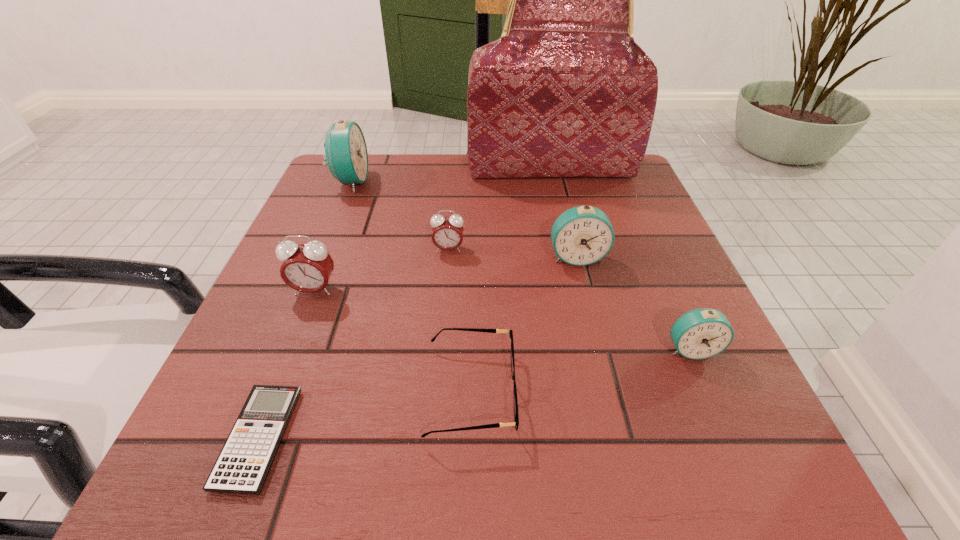
Image resolution: width=960 pixels, height=540 pixels. I want to click on blank region between the second nearest blue alarm clock and the rightmost blue alarm clock, so click(x=634, y=303).

Locate an element on the screen. The width and height of the screenshot is (960, 540). vacant space that's between the tallest object and the second blue alarm clock from left to right is located at coordinates (564, 212).

This screenshot has height=540, width=960. What are the coordinates of `unoccupied position between the spectacles and the handbag` in the screenshot? It's located at (511, 279).

At what (x,y) coordinates should I click in order to perform the action: click on vacant space that is in between the handbag and the farthest alarm clock. Please return your answer as a coordinate pair (x, y). Looking at the image, I should click on (450, 174).

You are a GUI agent. You are given a task and a screenshot of the screen. Output one action in this format:
    pyautogui.click(x=<x>, y=<y>)
    Task: Click on the vacant space that is in between the farthest alarm clock and the fourth alarm clock from left to right
    
    Given the screenshot: What is the action you would take?
    pyautogui.click(x=464, y=219)

The image size is (960, 540). I want to click on vacant point located between the smaller pink alarm clock and the nearer pink alarm clock, so click(381, 269).

This screenshot has height=540, width=960. Identify the location of free spot between the shortest object and the second farthest blue alarm clock. (418, 348).

Point out which object is positioned as the third nearest to the second farthest blue alarm clock. Please provide its 2D coordinates. Your answer should be formatted as a tuple, i.e. [(x, y)], where the tuple contains the x and y coordinates of a point satisfying the conditions above.

[(516, 417)]

Identify the location of object that is the second closest to the second blue alarm clock from right to left. (702, 333).

I want to click on alarm clock that is the fourth closest one to the handbag, so click(307, 268).